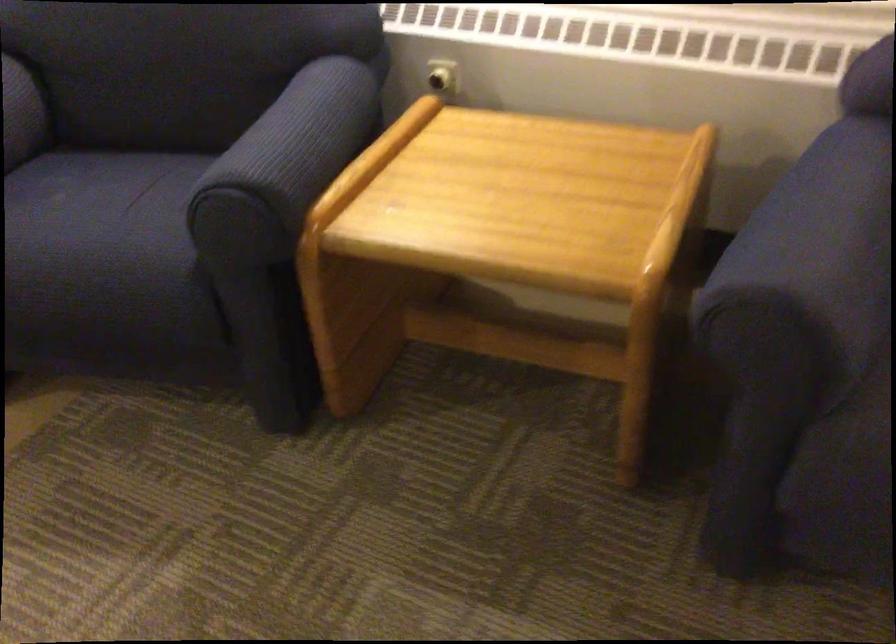
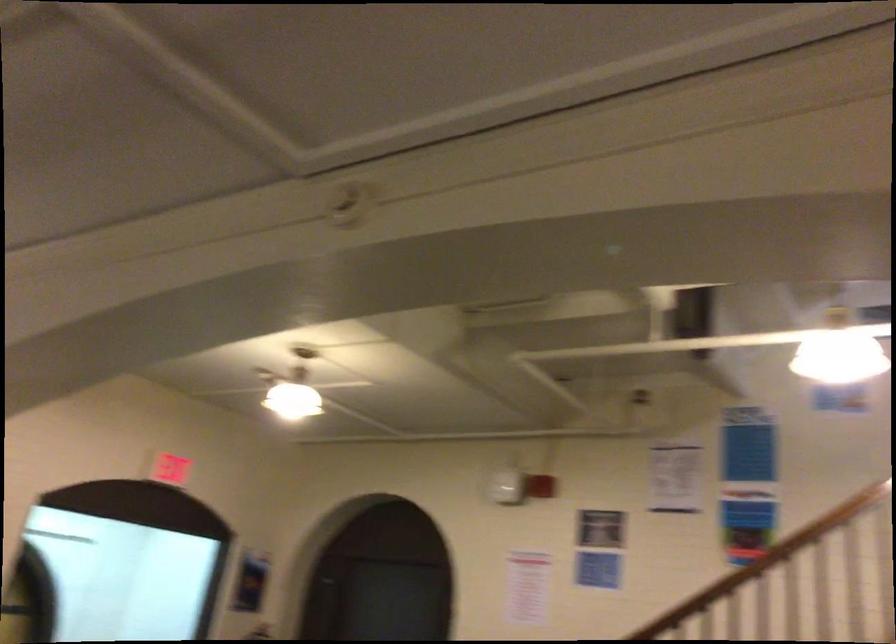
Question: How did the camera likely rotate?

Choices:
 (A) Left
 (B) Right
 (C) Up
 (D) Down

Answer: (A)